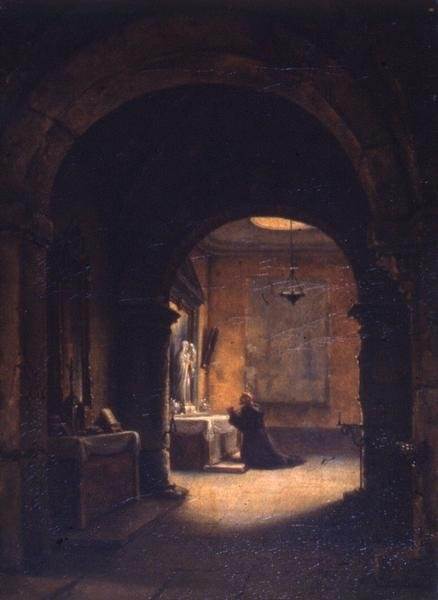
Where is `robe`? The width and height of the screenshot is (438, 600). robe is located at coordinates (255, 438).